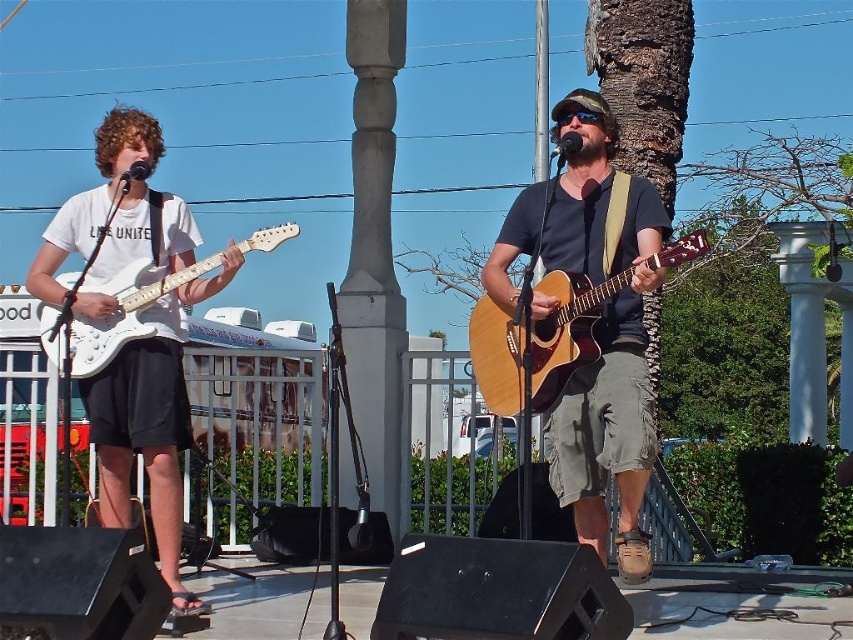
Question: Does natural wood acoustic guitar at center have a lesser width compared to white glossy electric guitar at left?

Choices:
 (A) yes
 (B) no

Answer: (A)

Question: Does wooden acoustic guitar at center have a larger size compared to natural wood acoustic guitar at center?

Choices:
 (A) yes
 (B) no

Answer: (A)

Question: Is white matte guitar at left to the left of white glossy electric guitar at left from the viewer's perspective?

Choices:
 (A) yes
 (B) no

Answer: (B)

Question: Which point is closer to the camera?

Choices:
 (A) natural wood acoustic guitar at center
 (B) white matte guitar at left

Answer: (A)

Question: Considering the real-world distances, which object is farthest from the white glossy electric guitar at left?

Choices:
 (A) wooden acoustic guitar at center
 (B) natural wood acoustic guitar at center
 (C) white matte guitar at left

Answer: (A)

Question: Which point is closer to the camera taking this photo?

Choices:
 (A) (276, 236)
 (B) (45, 244)
 (C) (554, 300)

Answer: (C)